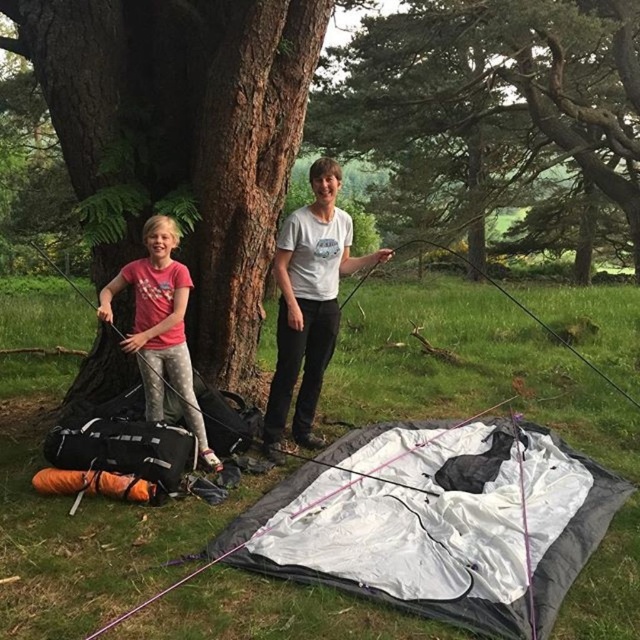
You are planning to take a photo of the green textured tree at center and the pink fabric shirt at left. Which object is wider when viewed from your current position?

The green textured tree at center is wider than the pink fabric shirt at left.

You are planning to set up a picnic blanket between the green textured tree at center and the orange fabric sleeping bag at lower left. If the picnic blanket requires 10 meters of space between the tree and the sleeping bag, will there be enough space?

The green textured tree at center is 11.57 meters away from the orange fabric sleeping bag at lower left, which is more than the required 10 meters. Therefore, there is enough space to set up the picnic blanket between them.